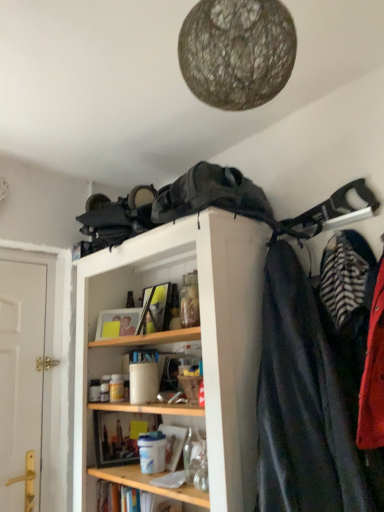
Question: Is white wooden door at left at the left side of wooden shelf at lower center?

Choices:
 (A) no
 (B) yes

Answer: (B)

Question: From the image's perspective, is white wooden door at left over wooden shelf at lower center?

Choices:
 (A) yes
 (B) no

Answer: (A)

Question: Is white wooden door at left facing towards wooden shelf at lower center?

Choices:
 (A) no
 (B) yes

Answer: (A)

Question: Is wooden shelf at lower center located within white wooden door at left?

Choices:
 (A) yes
 (B) no

Answer: (B)

Question: Is white wooden door at left positioned behind wooden shelf at lower center?

Choices:
 (A) yes
 (B) no

Answer: (A)

Question: Is white wooden door at left thinner than wooden shelf at lower center?

Choices:
 (A) yes
 (B) no

Answer: (A)

Question: From the image's perspective, is dark gray fabric backpack at upper center, placed as the 1th cloak when sorted from left to right, on top of wooden shelf at lower center?

Choices:
 (A) no
 (B) yes

Answer: (B)

Question: Is dark gray fabric backpack at upper center, which is counted as the 2th cloak, starting from the bottom, shorter than wooden shelf at lower center?

Choices:
 (A) yes
 (B) no

Answer: (B)

Question: Does dark gray fabric backpack at upper center, placed as the 1th cloak when sorted from left to right, have a greater width compared to wooden shelf at lower center?

Choices:
 (A) no
 (B) yes

Answer: (B)

Question: Is dark gray fabric backpack at upper center, placed as the 1th cloak when sorted from left to right, closer to camera compared to wooden shelf at lower center?

Choices:
 (A) no
 (B) yes

Answer: (B)

Question: Can you confirm if dark gray fabric backpack at upper center, which is counted as the 2th cloak, starting from the bottom, is positioned to the left of wooden shelf at lower center?

Choices:
 (A) yes
 (B) no

Answer: (B)

Question: Considering the relative positions of dark gray fabric backpack at upper center, the first cloak viewed from the top, and wooden shelf at lower center in the image provided, is dark gray fabric backpack at upper center, the first cloak viewed from the top, to the right of wooden shelf at lower center from the viewer's perspective?

Choices:
 (A) yes
 (B) no

Answer: (A)

Question: Considering the relative sizes of wooden shelf at lower center and wooden shelf at upper center in the image provided, is wooden shelf at lower center wider than wooden shelf at upper center?

Choices:
 (A) no
 (B) yes

Answer: (A)